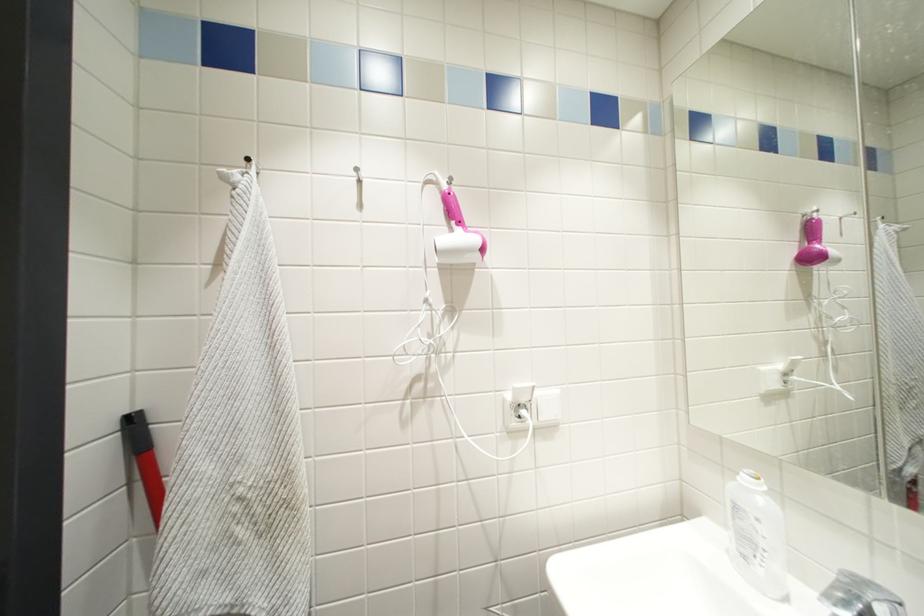
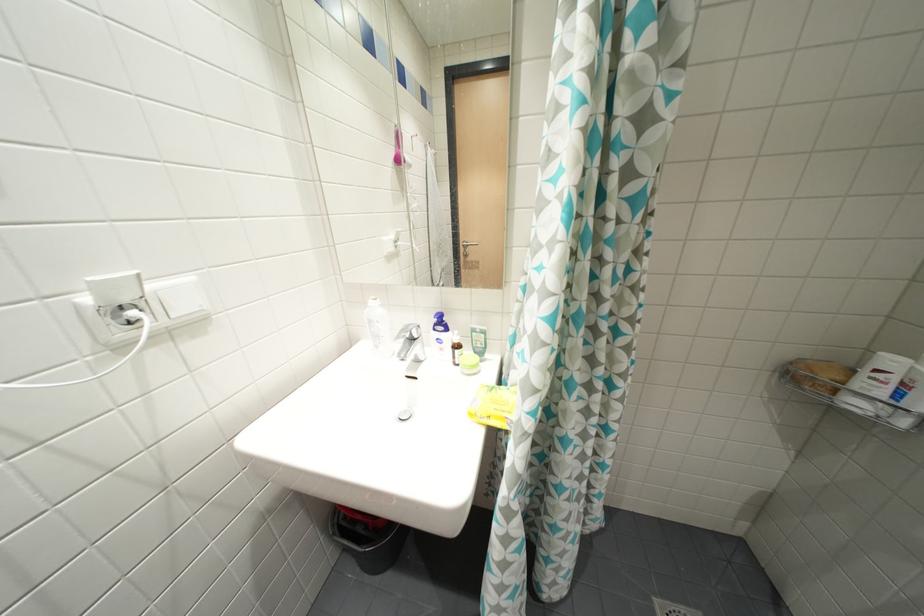
The images are taken continuously from a first-person perspective. In which direction is your viewpoint rotating?

The camera's rotation is toward right-down.